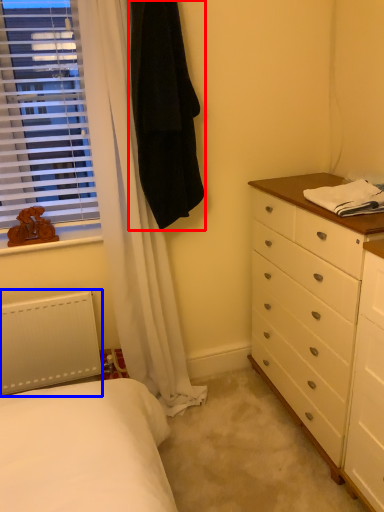
Question: Which object is further to the camera taking this photo, robe (highlighted by a red box) or radiator (highlighted by a blue box)?

Choices:
 (A) robe
 (B) radiator

Answer: (B)